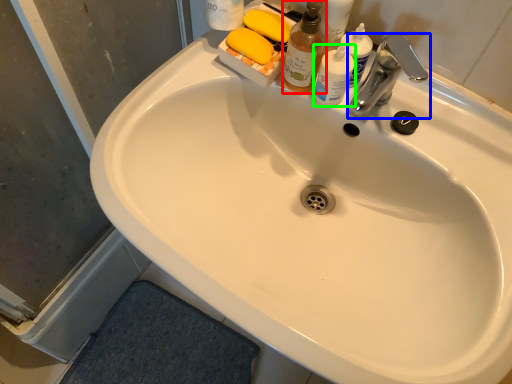
Question: Based on their relative distances, which object is nearer to cleaning product (highlighted by a red box)? Choose from tap (highlighted by a blue box) and toiletry (highlighted by a green box).

Choices:
 (A) tap
 (B) toiletry

Answer: (B)